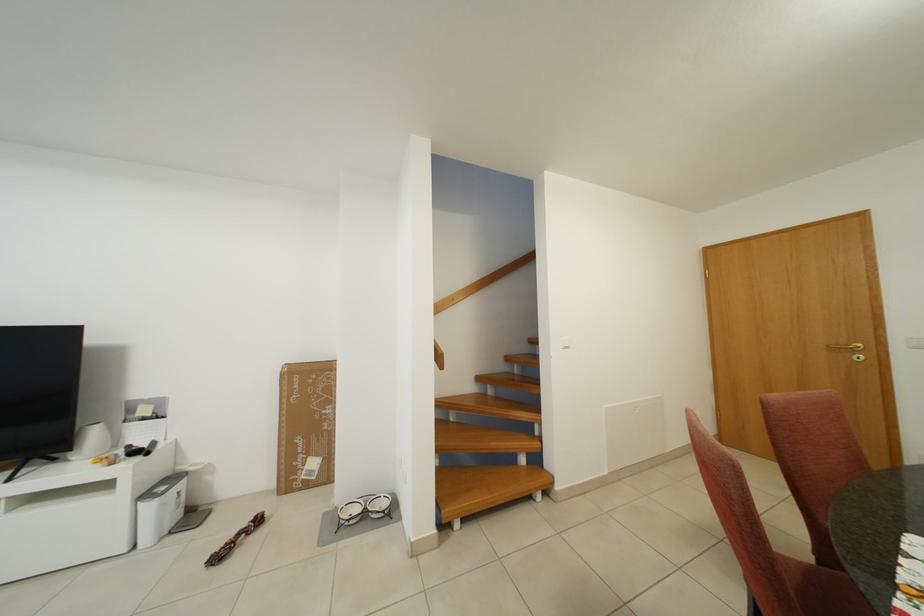
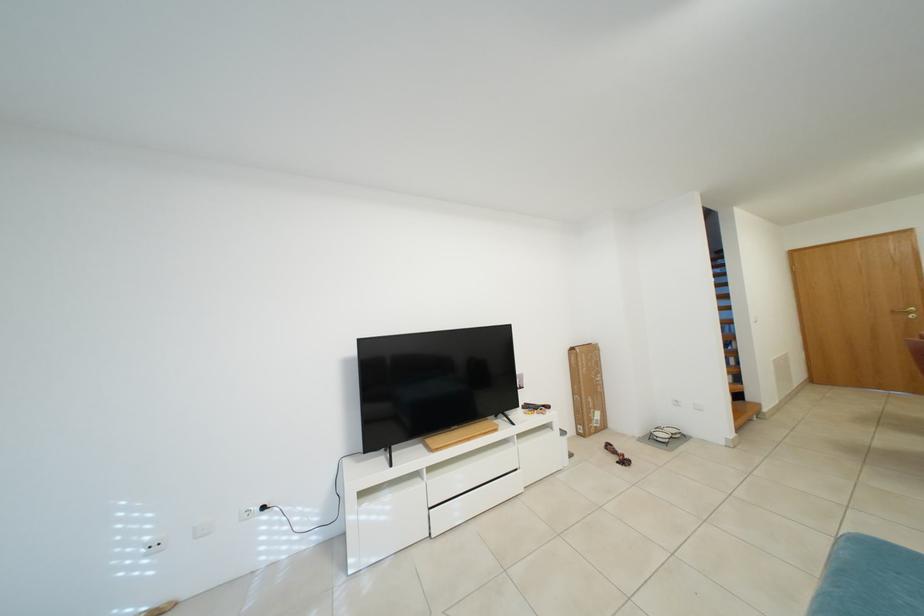
Find the pixel in the second image that matches (x=322, y=468) in the first image.

(605, 419)